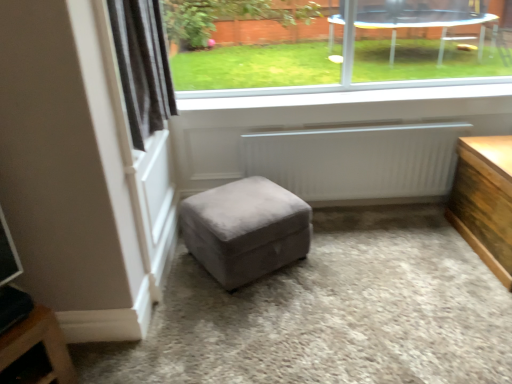
Question: Can you confirm if wooden table at right is taller than black velvet curtain at upper left?

Choices:
 (A) yes
 (B) no

Answer: (B)

Question: From a real-world perspective, is wooden table at right over black velvet curtain at upper left?

Choices:
 (A) yes
 (B) no

Answer: (B)

Question: Is wooden table at right shorter than black velvet curtain at upper left?

Choices:
 (A) no
 (B) yes

Answer: (B)

Question: Is wooden table at right positioned far away from black velvet curtain at upper left?

Choices:
 (A) yes
 (B) no

Answer: (A)

Question: From a real-world perspective, is wooden table at right positioned under black velvet curtain at upper left based on gravity?

Choices:
 (A) no
 (B) yes

Answer: (B)

Question: Looking at their shapes, would you say wooden table at right is wider or thinner than white matte radiator at center?

Choices:
 (A) thin
 (B) wide

Answer: (B)

Question: Is point (476, 205) closer or farther from the camera than point (393, 190)?

Choices:
 (A) farther
 (B) closer

Answer: (B)

Question: Based on their sizes in the image, would you say wooden table at right is bigger or smaller than white matte radiator at center?

Choices:
 (A) small
 (B) big

Answer: (B)

Question: From the image's perspective, is wooden table at right above or below white matte radiator at center?

Choices:
 (A) below
 (B) above

Answer: (A)

Question: From the image's perspective, relative to transparent glass window at upper center, is suede gray ottoman at center above or below?

Choices:
 (A) above
 (B) below

Answer: (B)

Question: Based on their positions, is suede gray ottoman at center located to the left or right of transparent glass window at upper center?

Choices:
 (A) right
 (B) left

Answer: (B)

Question: Is suede gray ottoman at center taller or shorter than transparent glass window at upper center?

Choices:
 (A) short
 (B) tall

Answer: (A)

Question: Is suede gray ottoman at center spatially inside transparent glass window at upper center, or outside of it?

Choices:
 (A) outside
 (B) inside

Answer: (A)

Question: Would you say transparent glass window at upper center is to the left or to the right of suede gray ottoman at center in the picture?

Choices:
 (A) left
 (B) right

Answer: (B)

Question: Considering the positions of point (430, 81) and point (218, 264), is point (430, 81) closer or farther from the camera than point (218, 264)?

Choices:
 (A) closer
 (B) farther

Answer: (B)